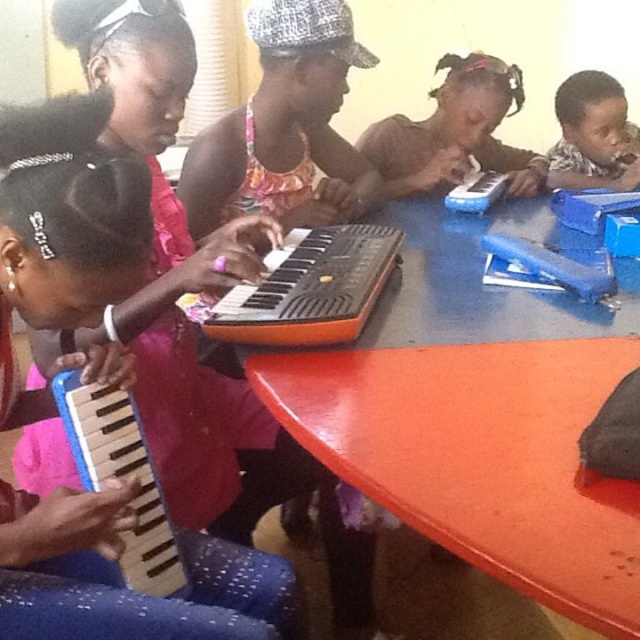
Question: Which object is the closest to the matte plastic keyboard at upper center?

Choices:
 (A) matte blue toy piano at upper right
 (B) wooden accordion at lower left
 (C) blue plastic keyboard at lower left
 (D) blue plastic table at center

Answer: (A)

Question: Observing the image, what is the correct spatial positioning of blue plastic keyboard at lower left in reference to wooden accordion at lower left?

Choices:
 (A) right
 (B) left

Answer: (B)

Question: Does blue plastic table at center appear under blue plastic keyboard at lower left?

Choices:
 (A) yes
 (B) no

Answer: (B)

Question: Is wooden accordion at lower left above matte blue toy piano at upper right?

Choices:
 (A) yes
 (B) no

Answer: (B)

Question: Among these points, which one is nearest to the camera?

Choices:
 (A) (413, 144)
 (B) (541, 468)

Answer: (B)

Question: Which object is the closest to the orange plastic keyboard at center?

Choices:
 (A) blue plastic table at center
 (B) wooden accordion at lower left

Answer: (A)